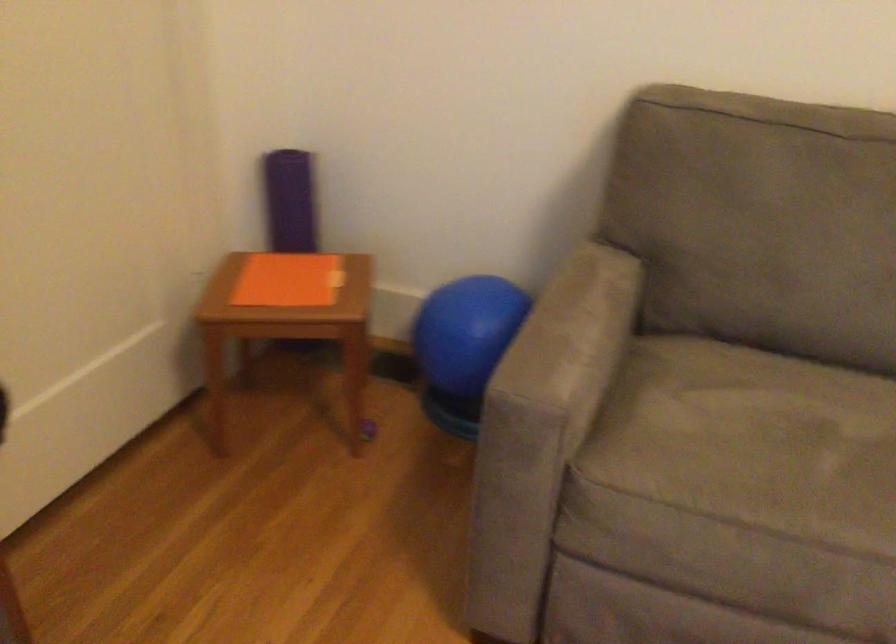
Find where to sit the sofa sitting surface. Please return your answer as a coordinate pair (x, y).

(752, 442)